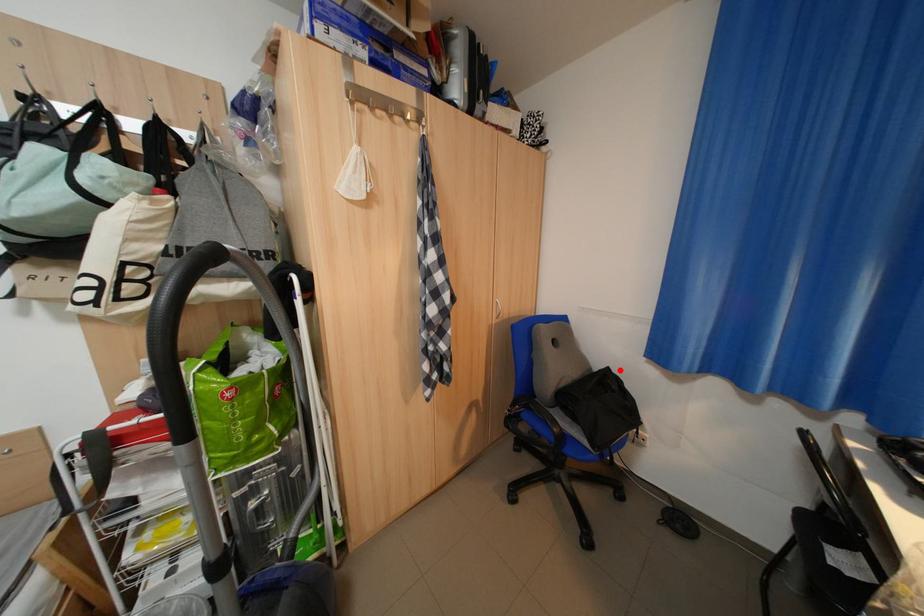
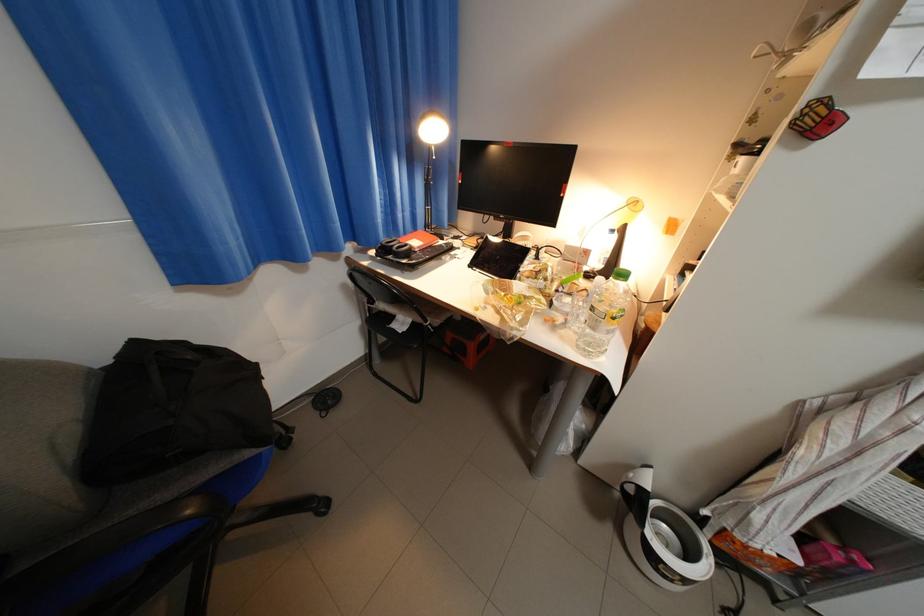
Where in the second image is the point corresponding to the highlighted location from the first image?

(147, 344)